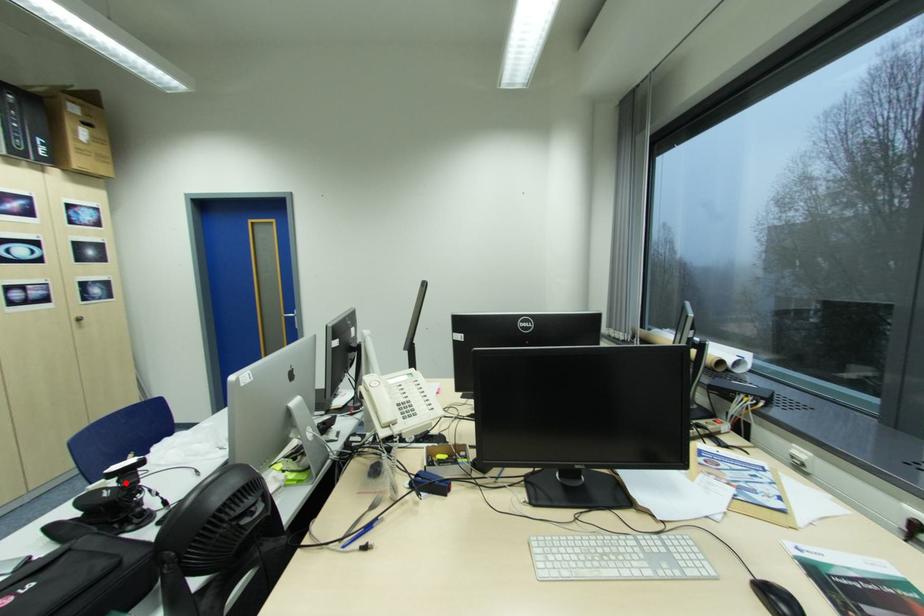
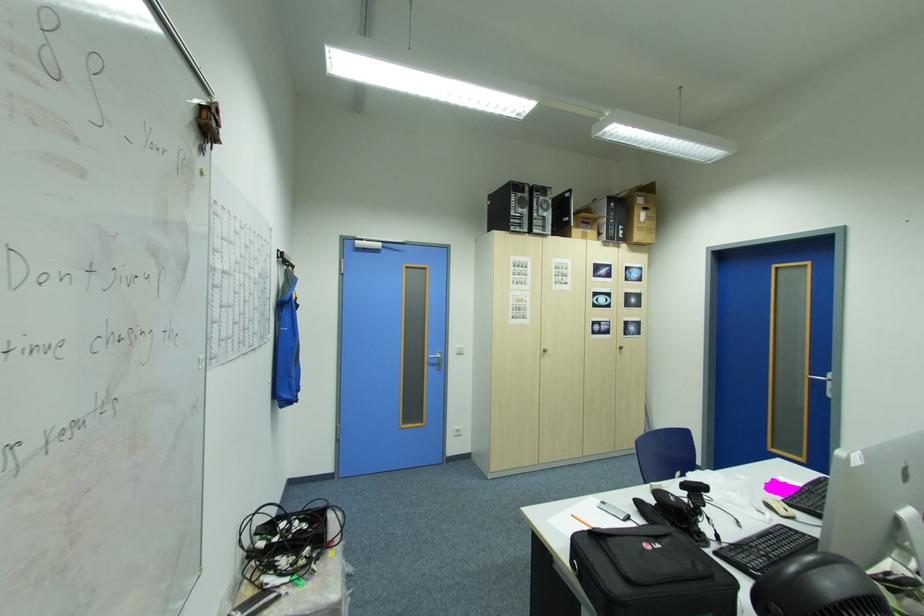
In the second image, find the point that corresponds to the highlighted location in the first image.

(697, 496)